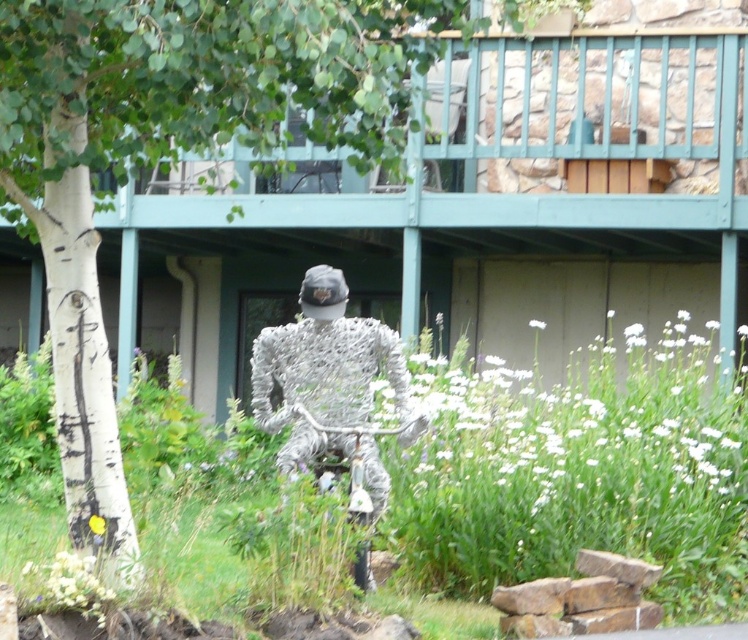
You are an artist planning to create a miniature model of the scene. You need to know which object between the white bark tree at center and the silver wire sculpture at center requires more space in your model. Which one should you allocate more space for?

The silver wire sculpture at center requires more space in the model because it occupies more space than the white bark tree at center according to the description.

You are standing in the garden and want to take a photo of the white bark tree at center and the silver wire sculpture at center. Which object should you focus on first if you want to capture both in the same frame without moving the camera?

The white bark tree at center is shorter than the silver wire sculpture at center, so you should focus on the silver wire sculpture at center first to ensure both are in the frame.

You are a gardener looking at the white bark tree at center and the silver wire sculpture at center. Which object is located higher up in the image?

The white bark tree at center is positioned over the silver wire sculpture at center, so it is higher up.